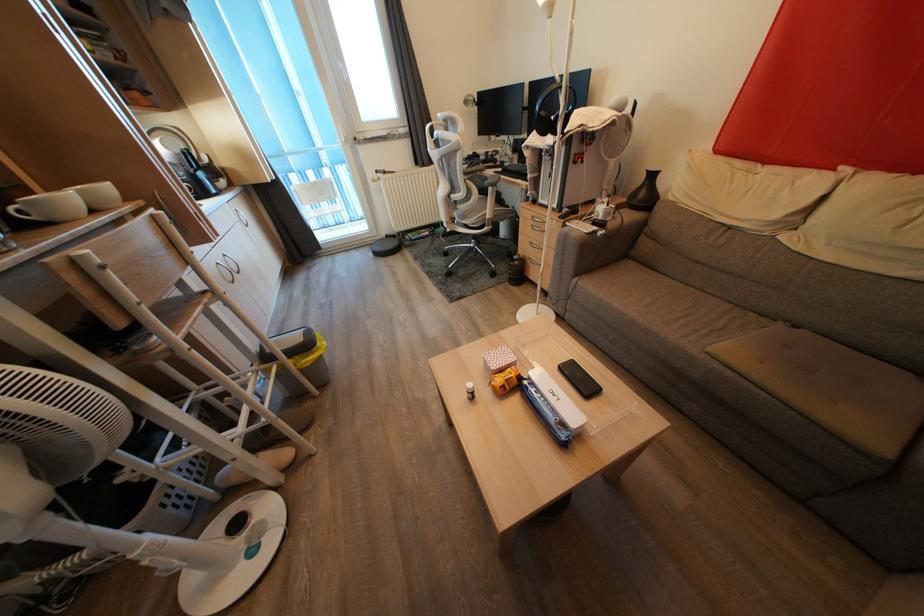
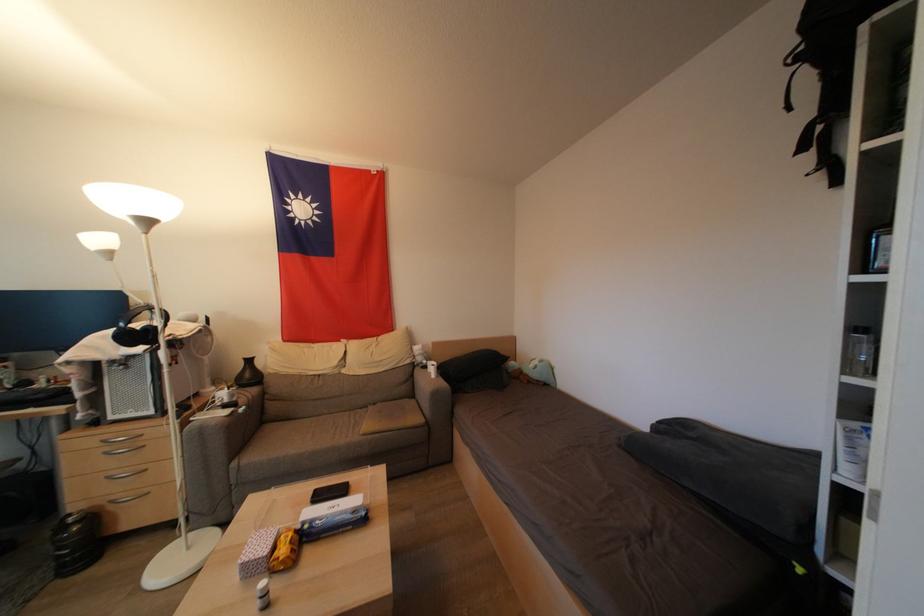
The point at (x=505, y=375) is marked in the first image. Where is the corresponding point in the second image?

(277, 553)